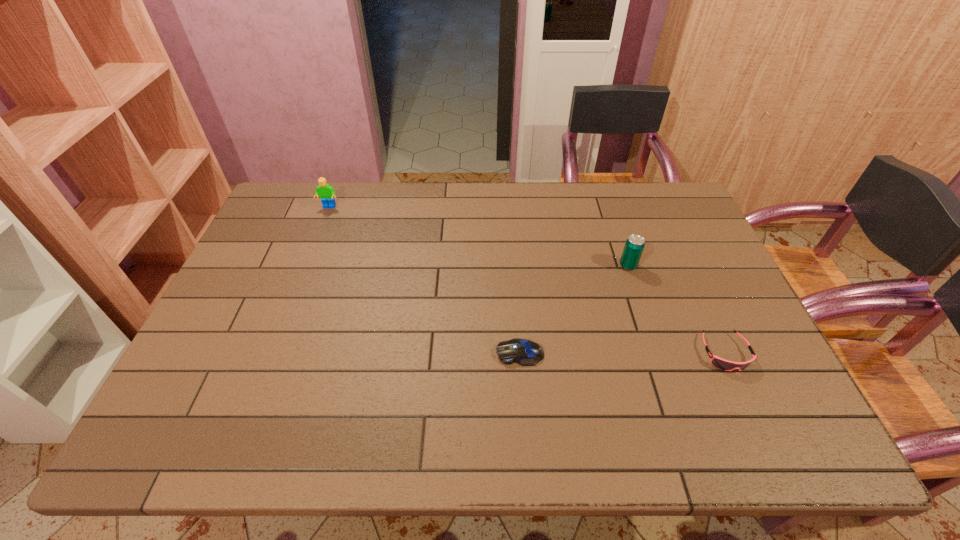
Find the location of a particular element. The image size is (960, 540). Lego is located at coordinates (325, 191).

At what (x,y) coordinates should I click in order to perform the action: click on the leftmost object. Please return your answer as a coordinate pair (x, y). The height and width of the screenshot is (540, 960). Looking at the image, I should click on (325, 191).

I want to click on beer can, so click(634, 246).

Where is `the third nearest object`? This screenshot has height=540, width=960. the third nearest object is located at coordinates (634, 246).

Where is `goggles`? The width and height of the screenshot is (960, 540). goggles is located at coordinates (x=723, y=364).

Identify the location of the rightmost object. (723, 364).

In order to click on the shortest object in this screenshot , I will do `click(525, 352)`.

Locate an element on the screen. The width and height of the screenshot is (960, 540). the second object from left to right is located at coordinates (525, 352).

Where is `vacant position located on the face of the leftmost object`? vacant position located on the face of the leftmost object is located at coordinates (309, 259).

Locate an element on the screen. This screenshot has height=540, width=960. vacant space located 0.090m on the front of the beer can is located at coordinates (638, 295).